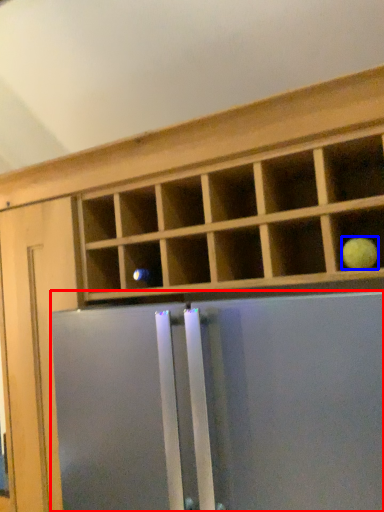
Question: Which of the following is the closest to the observer, screen door (highlighted by a red box) or fruit (highlighted by a blue box)?

Choices:
 (A) screen door
 (B) fruit

Answer: (A)